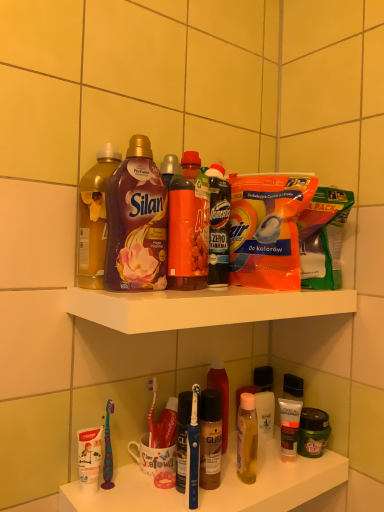
Where is `empty space that is to the right of blue plastic toothbrush at lower center`? This screenshot has height=512, width=384. empty space that is to the right of blue plastic toothbrush at lower center is located at coordinates (250, 492).